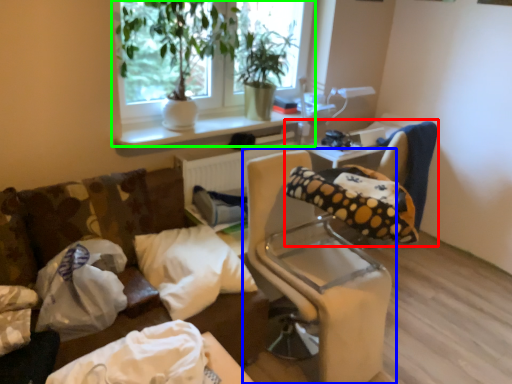
Question: Which object is positioned farthest from bean bag chair (highlighted by a red box)? Select from furniture (highlighted by a blue box) and window (highlighted by a green box).

Choices:
 (A) furniture
 (B) window

Answer: (B)